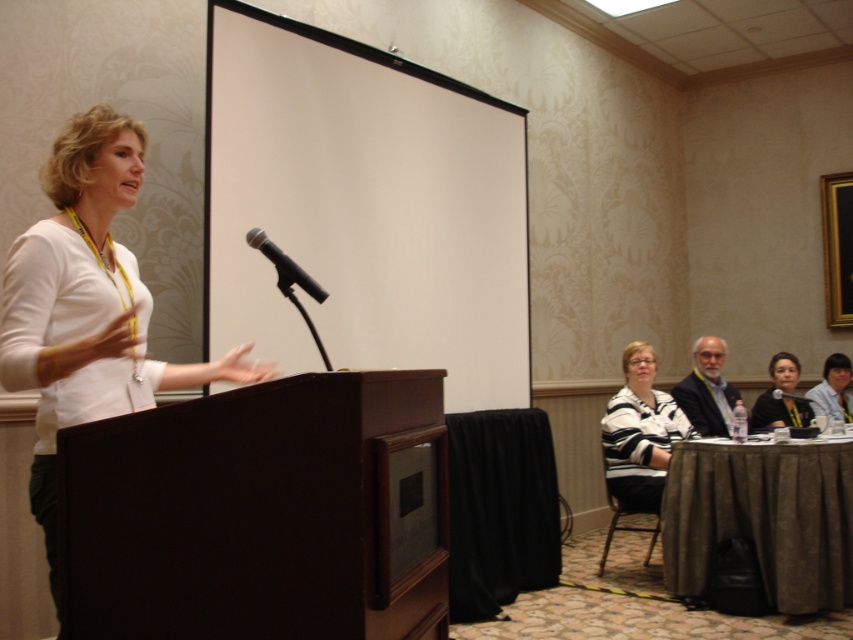
Which of these two, brown fabric table at lower right or striped sweater at center, stands shorter?

Standing shorter between the two is brown fabric table at lower right.

Based on the photo, does brown fabric table at lower right appear over striped sweater at center?

No, brown fabric table at lower right is not above striped sweater at center.

The image size is (853, 640). Identify the location of brown fabric table at lower right. (762, 516).

Looking at this image, does dark brown suit at lower right have a lesser height compared to black plastic microphone at center?

No.

What do you see at coordinates (706, 388) in the screenshot?
I see `dark brown suit at lower right` at bounding box center [706, 388].

Identify the location of dark brown suit at lower right. This screenshot has width=853, height=640. (706, 388).

Is striped sweater at center thinner than matte black shirt at lower right?

Correct, striped sweater at center's width is less than matte black shirt at lower right's.

Can you confirm if striped sweater at center is positioned above matte black shirt at lower right?

No.

Who is more distant from viewer, (666, 458) or (793, 422)?

The point (793, 422) is behind.

The width and height of the screenshot is (853, 640). I want to click on striped sweater at center, so click(x=639, y=433).